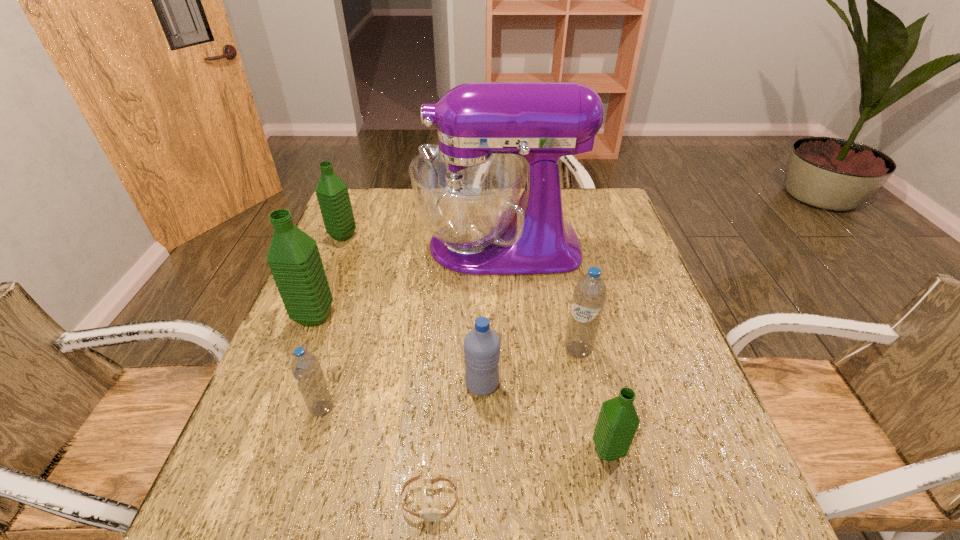
Find the location of a particular element. The height and width of the screenshot is (540, 960). the seventh farthest object is located at coordinates [x=618, y=421].

Where is `the leftmost blue water bottle`? the leftmost blue water bottle is located at coordinates (306, 369).

Identify the location of the third water bottle from left to right. point(306,369).

Image resolution: width=960 pixels, height=540 pixels. I want to click on watch, so click(x=429, y=514).

At what (x,y) coordinates should I click in order to perform the action: click on beige watch. Please return your answer as a coordinate pair (x, y). The height and width of the screenshot is (540, 960). Looking at the image, I should click on (429, 514).

Locate an element on the screen. Image resolution: width=960 pixels, height=540 pixels. vacant space located at the bowl opening of the purple mixer is located at coordinates (388, 246).

Locate an element on the screen. The height and width of the screenshot is (540, 960). vacant space located 0.260m at the bowl opening of the purple mixer is located at coordinates (330, 246).

Where is `vacant space located at the bowl opening of the purple mixer`? The height and width of the screenshot is (540, 960). vacant space located at the bowl opening of the purple mixer is located at coordinates (368, 246).

Image resolution: width=960 pixels, height=540 pixels. Identify the location of vacant space located 0.170m on the right of the second nearest green water bottle. (401, 316).

This screenshot has width=960, height=540. I want to click on free space located on the front of the farthest green water bottle, so click(315, 306).